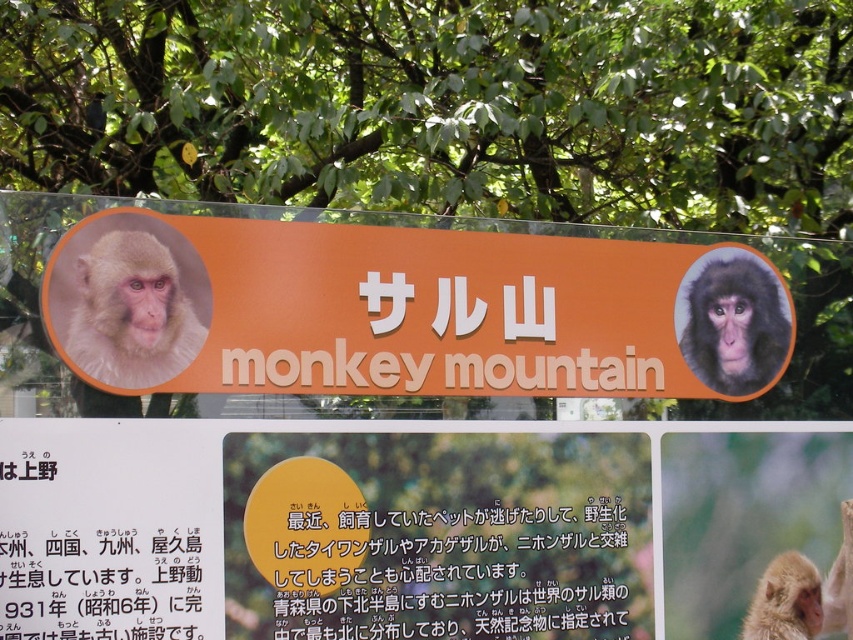
Question: Is light brown fur monkey at center positioned before golden fur monkey at center?

Choices:
 (A) yes
 (B) no

Answer: (A)

Question: Can you confirm if green leafy tree at upper center is thinner than dark brown fur monkey at upper right?

Choices:
 (A) yes
 (B) no

Answer: (B)

Question: Which of the following is the closest to the observer?

Choices:
 (A) light brown fur monkey at left
 (B) yellow paper at center

Answer: (A)

Question: Does light brown fur monkey at left have a smaller size compared to dark brown fur monkey at upper right?

Choices:
 (A) yes
 (B) no

Answer: (A)

Question: Which of the following is the closest to the observer?

Choices:
 (A) black paper at lower left
 (B) dark brown fur monkey at upper right

Answer: (A)

Question: Based on their relative distances, which object is farther from the golden fur monkey at center?

Choices:
 (A) light brown fur monkey at center
 (B) orange matte signboard at center

Answer: (B)